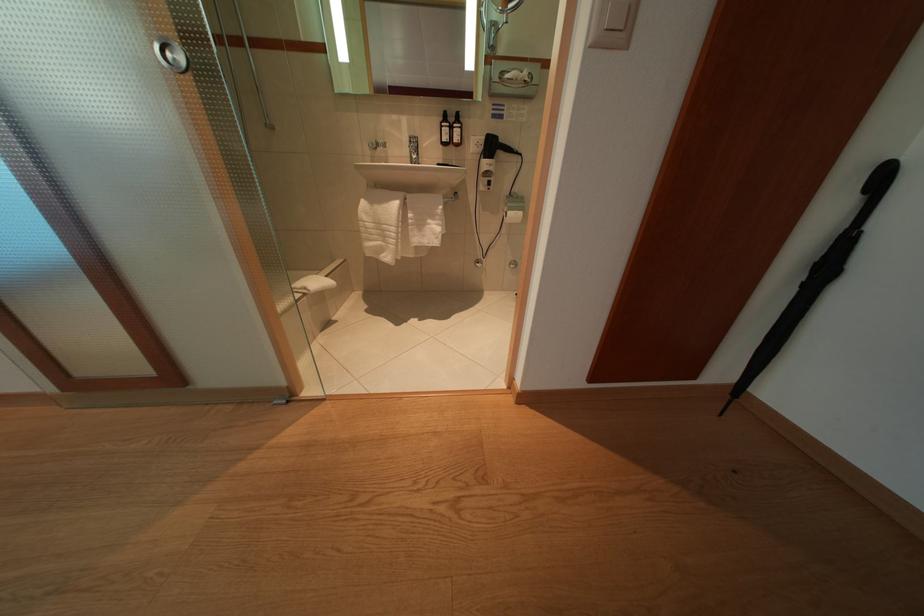
This screenshot has width=924, height=616. Describe the element at coordinates (514, 219) in the screenshot. I see `the toilet paper roll` at that location.